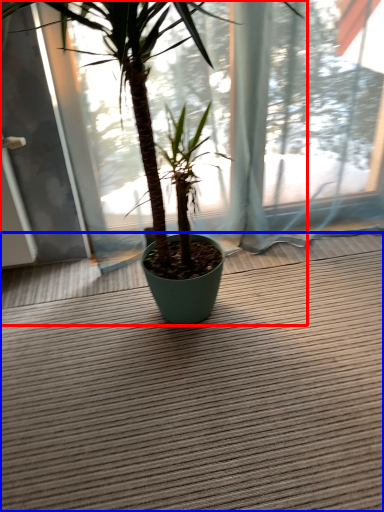
Question: Which object appears farthest to the camera in this image, houseplant (highlighted by a red box) or doormat (highlighted by a blue box)?

Choices:
 (A) houseplant
 (B) doormat

Answer: (B)